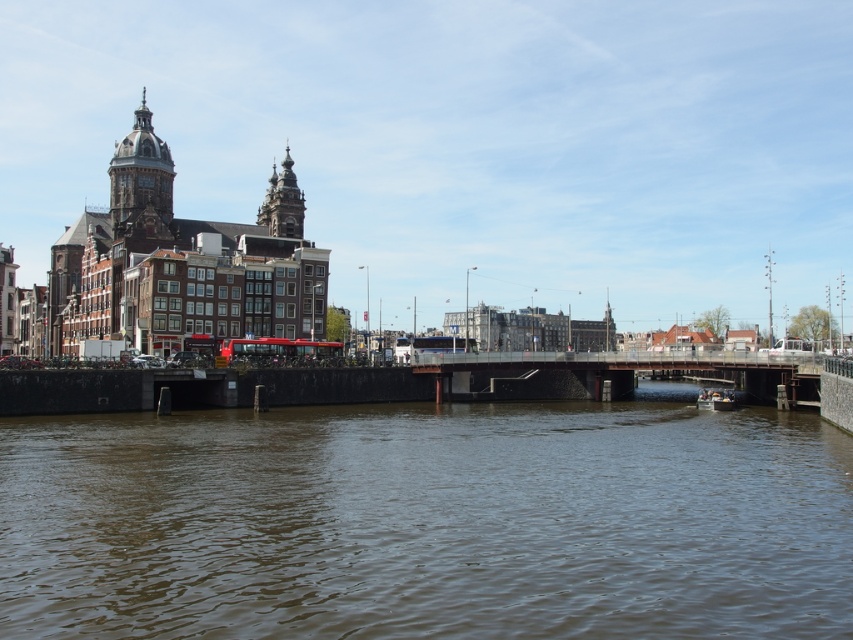
You are standing at the bridge over the canal and want to take a photo of both the historic buildings on the left and the modern bridge structure. Which point, point (x=144, y=108) or point (x=334, y=353), is closer to you as you stand on the bridge?

Point (x=144, y=108) is closer to you because it is further to the camera than point (x=334, y=353).

You are a tourist standing on the bridge over the canal. You notice the brown murky water at center and the smooth black boat at lower right. Which object is higher in elevation from your viewpoint?

The brown murky water at center has a greater height compared to the smooth black boat at lower right, so the brown murky water at center is higher in elevation from your viewpoint.